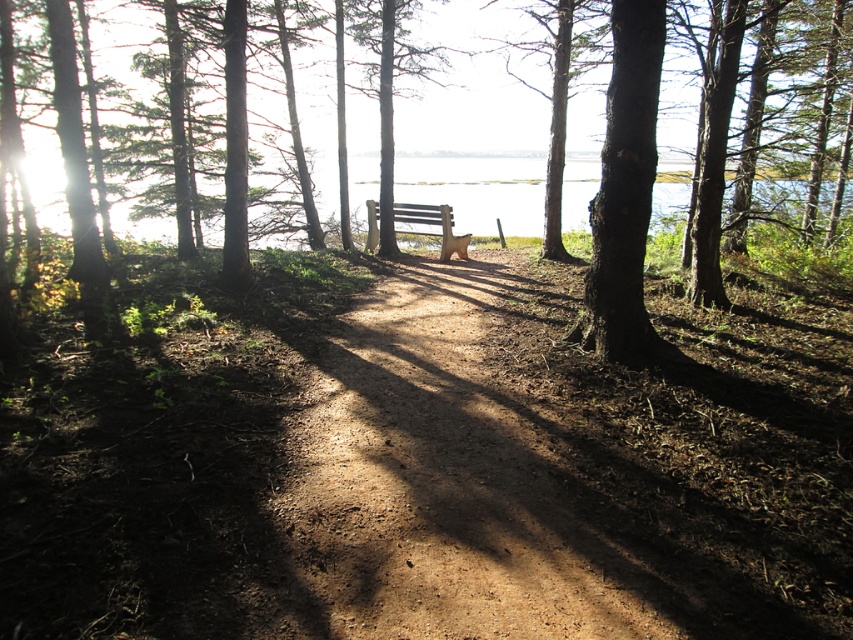
You are a hiker trying to decide whether to walk along the dirt path at center or sit on the brown wooden bench at center. Based on their widths, which option allows for more space?

The dirt path at center is wider than the brown wooden bench at center, so walking along the dirt path at center provides more space.

You are standing at the edge of the forest and see the dirt path at center and the brown wooden bench at center. Which object is nearer to you?

The dirt path at center is closer to the viewer than the brown wooden bench at center, so the dirt path at center is nearer.

Looking at this image, you are a hiker who wants to sit down and rest. You see a dirt path at center and a brown wooden bench at center. Which one is lower to the ground?

The dirt path at center is below brown wooden bench at center, so the dirt path at center is lower to the ground.